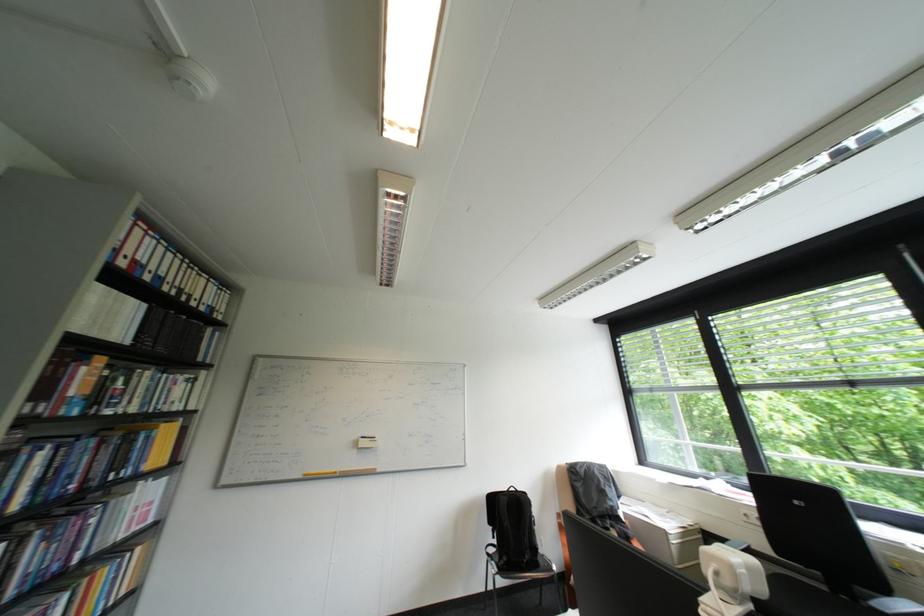
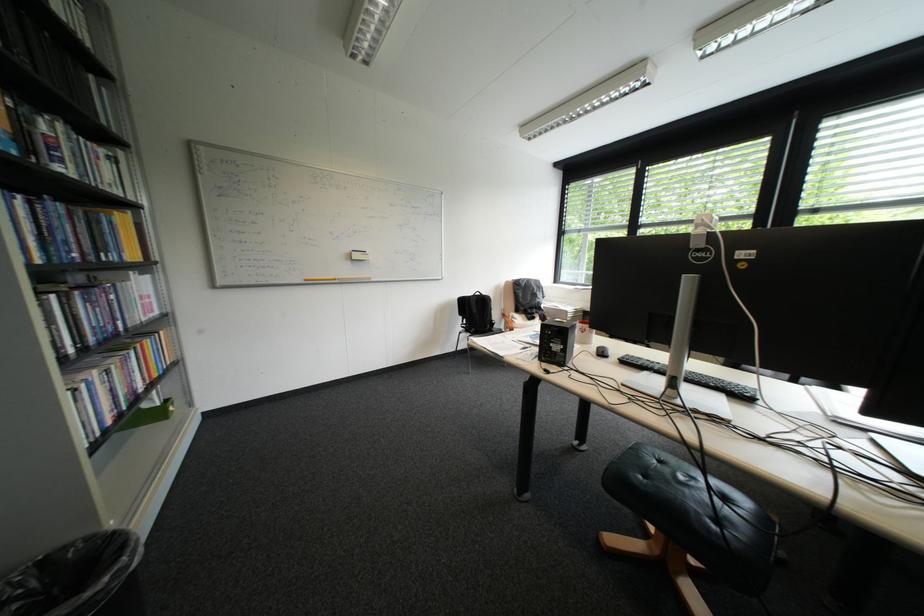
How did the camera likely rotate?

The camera's rotation is toward right-down.